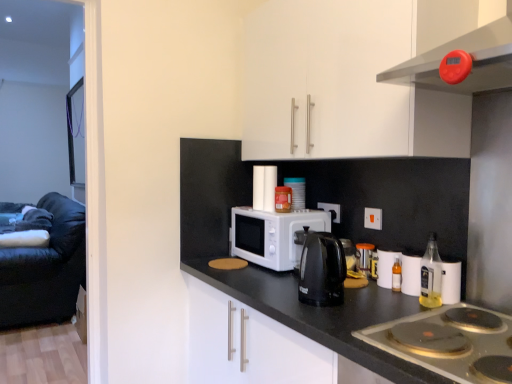
Locate an element on the screen. This screenshot has height=384, width=512. free space to the left of black plastic kettle at center is located at coordinates (274, 300).